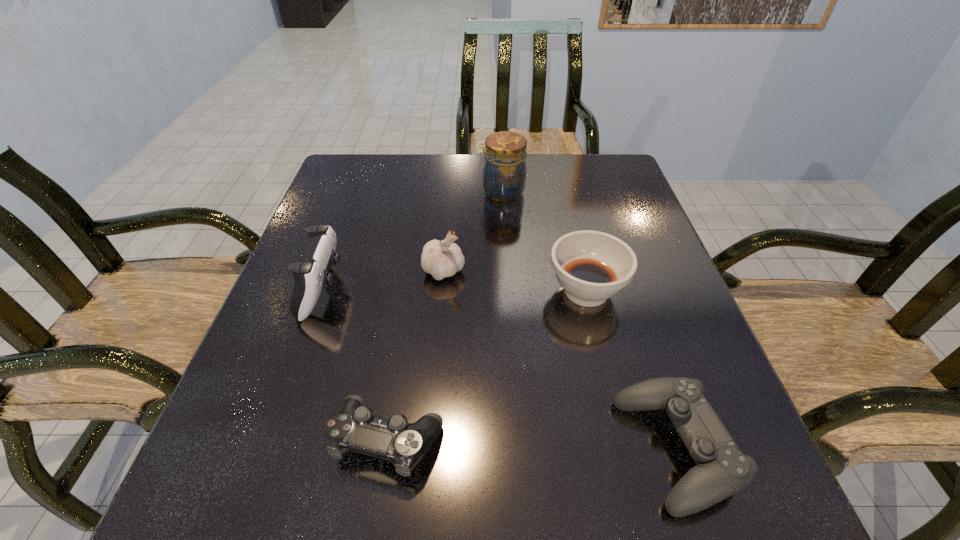
Find the location of a particular element. Image resolution: width=960 pixels, height=540 pixels. control that is the second closest to the rightmost control is located at coordinates pos(310,275).

This screenshot has width=960, height=540. I want to click on free space that satisfies the following two spatial constraints: 1. on the back side of the fourth tallest object; 2. on the lid of the jar, so click(x=563, y=192).

The image size is (960, 540). What are the coordinates of `free space in the image that satisfies the following two spatial constraints: 1. on the front-facing side of the leftmost control; 2. on the right side of the second control from right to left` in the screenshot? It's located at (271, 439).

Identify the location of free space that satisfies the following two spatial constraints: 1. on the front-facing side of the fourth tallest object; 2. on the left side of the leftmost control. (323, 291).